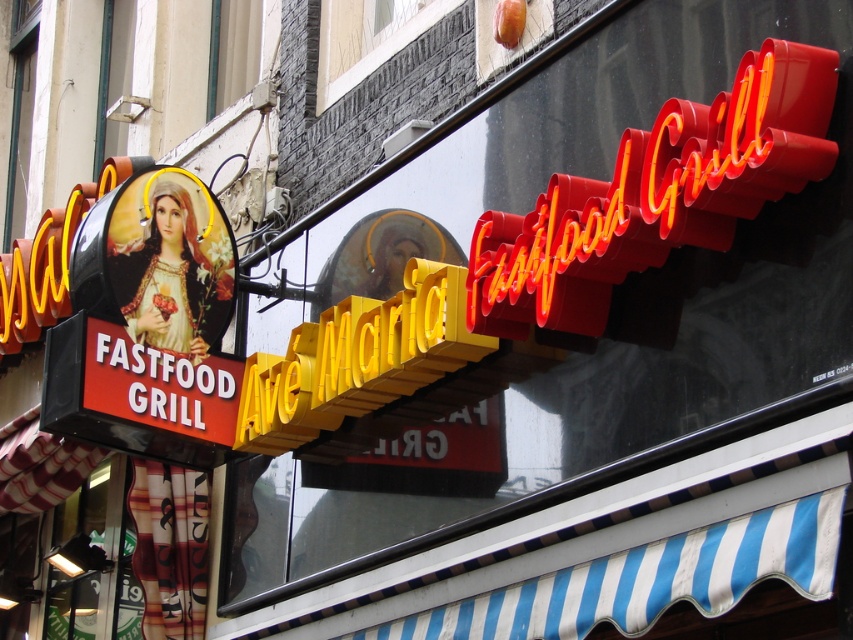
Image resolution: width=853 pixels, height=640 pixels. I want to click on neon red sign at upper right, so click(x=656, y=195).

Is point (636, 154) positioned in front of point (325, 404)?

Yes, point (636, 154) is closer to viewer.

Find the location of a particular element. neon red sign at upper right is located at coordinates (656, 195).